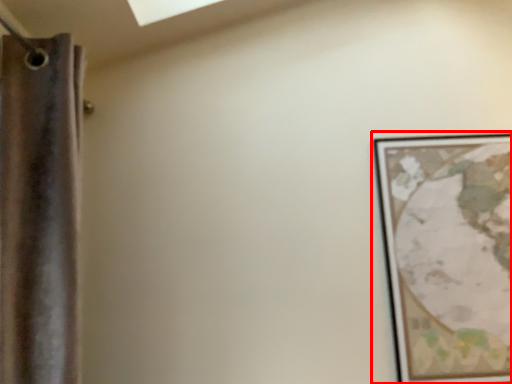
Question: From the image's perspective, considering the relative positions of picture frame (annotated by the red box) and curtain in the image provided, where is picture frame (annotated by the red box) located with respect to the staircase?

Choices:
 (A) below
 (B) above

Answer: (A)